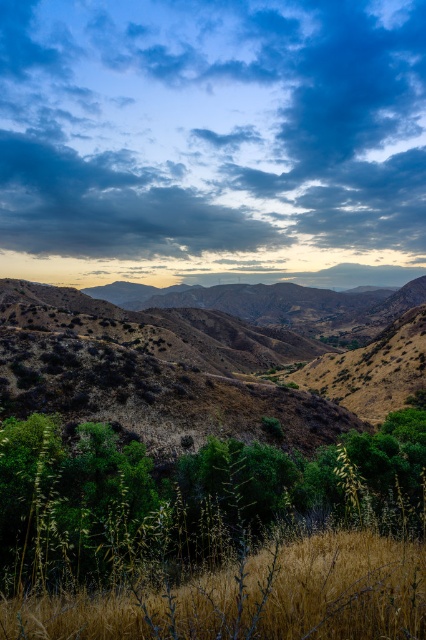
You are an artist planning to paint this landscape. You want to ensure the cloudy sky at upper center and dry grass at lower center are proportionally accurate. Which object should you make wider in your painting?

The cloudy sky at upper center should be made wider in the painting since its width is larger than the dry grass at lower center.